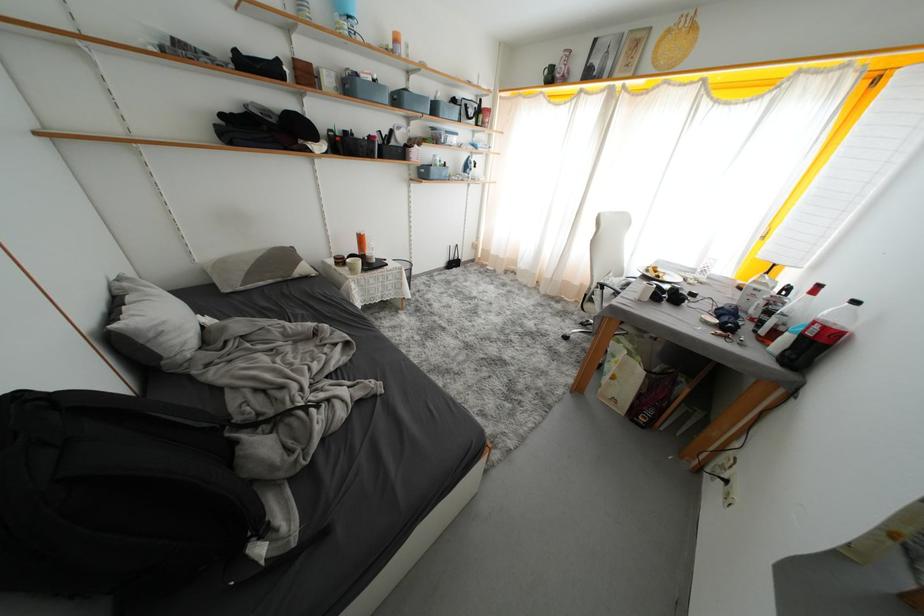
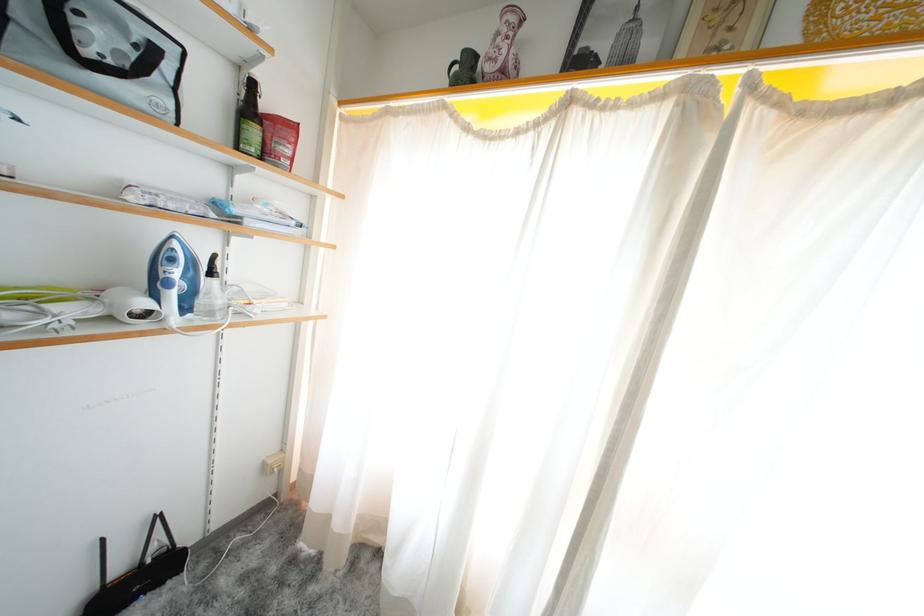
Question: In a continuous first-person perspective shot, in which direction is the camera moving?

Choices:
 (A) Left
 (B) Right
 (C) Forward
 (D) Backward

Answer: (C)